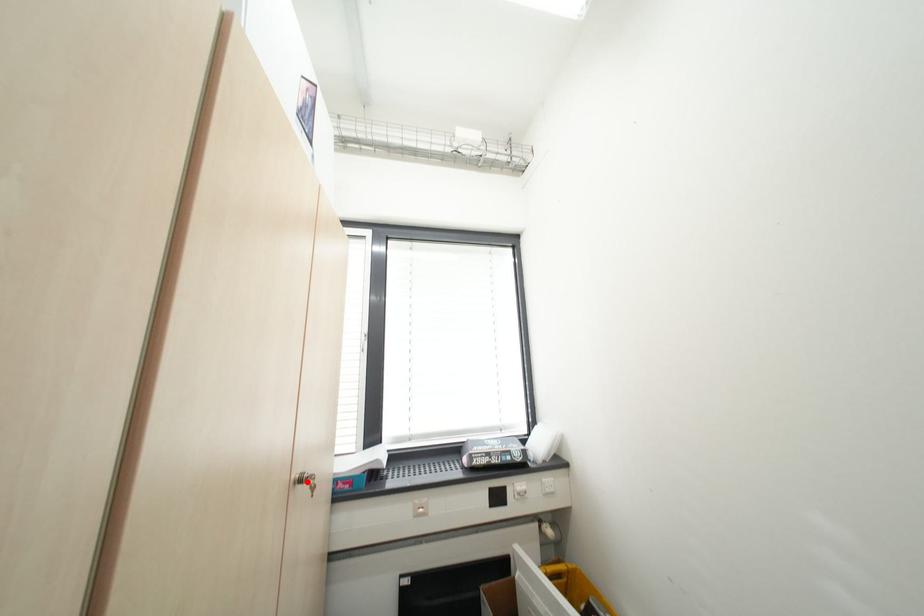
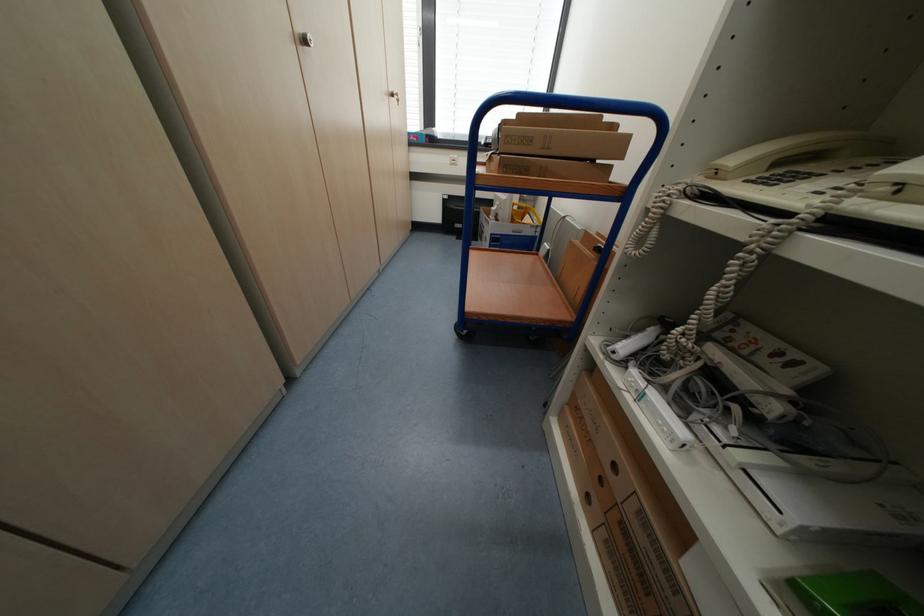
Find the pixel in the second image that matches the highlighted location in the first image.

(398, 95)